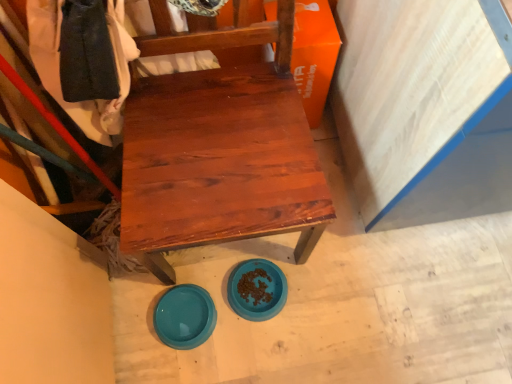
You are a GUI agent. You are given a task and a screenshot of the screen. Output one action in this format:
    pyautogui.click(x=<x>, y=<y>)
    Task: Click on the blue plastic bowl at lower center, marked as the 2th plate in a left-to-right arrangement
    Image resolution: width=512 pixels, height=384 pixels.
    Given the screenshot: What is the action you would take?
    pyautogui.click(x=257, y=289)

Consider the image. Measure the distance between matte wood chair at center and camera.

matte wood chair at center and camera are 33.08 inches apart.

At what (x,y) coordinates should I click in order to perform the action: click on blue plastic bowl at lower center, the 1th plate positioned from the right. Please return your answer as a coordinate pair (x, y). This screenshot has height=384, width=512. Looking at the image, I should click on (257, 289).

Is matte wood chair at center in front of or behind orange matte cardboard box at upper right in the image?

Clearly, matte wood chair at center is in front of orange matte cardboard box at upper right.

From a real-world perspective, between matte wood chair at center and orange matte cardboard box at upper right, who is vertically higher?

matte wood chair at center.

Could you tell me if matte wood chair at center is turned towards orange matte cardboard box at upper right?

No, matte wood chair at center does not turn towards orange matte cardboard box at upper right.

Can you tell me how much matte wood chair at center and orange matte cardboard box at upper right differ in facing direction?

The angular difference between matte wood chair at center and orange matte cardboard box at upper right is 1.07 degrees.

Is teal glossy plate at lower center, which is the second plate in right-to-left order, facing towards orange matte cardboard box at upper right?

No, teal glossy plate at lower center, which is the second plate in right-to-left order, is not turned towards orange matte cardboard box at upper right.

Who is bigger, teal glossy plate at lower center, which is the second plate in right-to-left order, or orange matte cardboard box at upper right?

orange matte cardboard box at upper right.

Which of these two, teal glossy plate at lower center, arranged as the 1th plate when viewed from the left, or orange matte cardboard box at upper right, stands shorter?

teal glossy plate at lower center, arranged as the 1th plate when viewed from the left, is shorter.

From the image's perspective, is teal glossy plate at lower center, which is the second plate in right-to-left order, positioned above or below orange matte cardboard box at upper right?

From the image's perspective, teal glossy plate at lower center, which is the second plate in right-to-left order, appears below orange matte cardboard box at upper right.

Which is in front, orange matte cardboard box at upper right or blue plastic bowl at lower center, marked as the 2th plate in a left-to-right arrangement?

orange matte cardboard box at upper right is in front.

Is orange matte cardboard box at upper right taller than blue plastic bowl at lower center, marked as the 2th plate in a left-to-right arrangement?

Yes.

Which object is positioned more to the left, orange matte cardboard box at upper right or blue plastic bowl at lower center, the 1th plate positioned from the right?

blue plastic bowl at lower center, the 1th plate positioned from the right, is more to the left.

Is orange matte cardboard box at upper right thinner than blue plastic bowl at lower center, the 1th plate positioned from the right?

Incorrect, the width of orange matte cardboard box at upper right is not less than that of blue plastic bowl at lower center, the 1th plate positioned from the right.

Who is more distant, blue plastic bowl at lower center, the 1th plate positioned from the right, or matte wood chair at center?

blue plastic bowl at lower center, the 1th plate positioned from the right, is further away from the camera.

Considering the points (269, 287) and (127, 173), which point is in front, point (269, 287) or point (127, 173)?

The point (127, 173) is closer to the camera.

Which is more to the left, blue plastic bowl at lower center, marked as the 2th plate in a left-to-right arrangement, or matte wood chair at center?

matte wood chair at center is more to the left.

Do you think blue plastic bowl at lower center, the 1th plate positioned from the right, is within matte wood chair at center, or outside of it?

blue plastic bowl at lower center, the 1th plate positioned from the right, is located inside matte wood chair at center.

Which object is positioned more to the right, blue plastic bowl at lower center, marked as the 2th plate in a left-to-right arrangement, or orange matte cardboard box at upper right?

orange matte cardboard box at upper right.

Considering the sizes of objects blue plastic bowl at lower center, marked as the 2th plate in a left-to-right arrangement, and orange matte cardboard box at upper right in the image provided, who is bigger, blue plastic bowl at lower center, marked as the 2th plate in a left-to-right arrangement, or orange matte cardboard box at upper right?

orange matte cardboard box at upper right is bigger.

Does point (240, 269) come behind point (321, 60)?

That is True.

Is teal glossy plate at lower center, which is the second plate in right-to-left order, positioned with its back to blue plastic bowl at lower center, the 1th plate positioned from the right?

teal glossy plate at lower center, which is the second plate in right-to-left order, does not have its back to blue plastic bowl at lower center, the 1th plate positioned from the right.

Considering the relative positions of teal glossy plate at lower center, arranged as the 1th plate when viewed from the left, and blue plastic bowl at lower center, the 1th plate positioned from the right, in the image provided, is teal glossy plate at lower center, arranged as the 1th plate when viewed from the left, to the left of blue plastic bowl at lower center, the 1th plate positioned from the right, from the viewer's perspective?

Yes, teal glossy plate at lower center, arranged as the 1th plate when viewed from the left, is to the left of blue plastic bowl at lower center, the 1th plate positioned from the right.

Is blue plastic bowl at lower center, the 1th plate positioned from the right, surrounded by teal glossy plate at lower center, arranged as the 1th plate when viewed from the left?

No, blue plastic bowl at lower center, the 1th plate positioned from the right, is not inside teal glossy plate at lower center, arranged as the 1th plate when viewed from the left.

Which point is more distant from viewer, (x=284, y=52) or (x=277, y=308)?

The point (x=277, y=308) is farther.

Consider the image. Which of these two, matte wood chair at center or blue plastic bowl at lower center, marked as the 2th plate in a left-to-right arrangement, stands taller?

matte wood chair at center.

Is matte wood chair at center wider than blue plastic bowl at lower center, the 1th plate positioned from the right?

Correct, the width of matte wood chair at center exceeds that of blue plastic bowl at lower center, the 1th plate positioned from the right.

At what (x,y) coordinates should I click in order to perform the action: click on chair lying on the left of orange matte cardboard box at upper right. Please return your answer as a coordinate pair (x, y). Looking at the image, I should click on (218, 147).

From the image's perspective, count 2nd plates downward from the orange matte cardboard box at upper right and point to it. Please provide its 2D coordinates.

[(185, 316)]

Estimate the real-world distances between objects in this image. Which object is closer to blue plastic bowl at lower center, marked as the 2th plate in a left-to-right arrangement, teal glossy plate at lower center, arranged as the 1th plate when viewed from the left, or matte wood chair at center?

Based on the image, teal glossy plate at lower center, arranged as the 1th plate when viewed from the left, appears to be nearer to blue plastic bowl at lower center, marked as the 2th plate in a left-to-right arrangement.

Estimate the real-world distances between objects in this image. Which object is closer to teal glossy plate at lower center, arranged as the 1th plate when viewed from the left, matte wood chair at center or orange matte cardboard box at upper right?

matte wood chair at center is closer to teal glossy plate at lower center, arranged as the 1th plate when viewed from the left.

From the image, which object appears to be nearer to matte wood chair at center, blue plastic bowl at lower center, marked as the 2th plate in a left-to-right arrangement, or orange matte cardboard box at upper right?

orange matte cardboard box at upper right lies closer to matte wood chair at center than the other object.

Based on their spatial positions, is teal glossy plate at lower center, arranged as the 1th plate when viewed from the left, or orange matte cardboard box at upper right further from blue plastic bowl at lower center, marked as the 2th plate in a left-to-right arrangement?

orange matte cardboard box at upper right is positioned further to the anchor blue plastic bowl at lower center, marked as the 2th plate in a left-to-right arrangement.

Based on their spatial positions, is blue plastic bowl at lower center, marked as the 2th plate in a left-to-right arrangement, or teal glossy plate at lower center, arranged as the 1th plate when viewed from the left, closer to orange matte cardboard box at upper right?

blue plastic bowl at lower center, marked as the 2th plate in a left-to-right arrangement, is closer to orange matte cardboard box at upper right.

Based on their spatial positions, is orange matte cardboard box at upper right or blue plastic bowl at lower center, the 1th plate positioned from the right, closer to matte wood chair at center?

Based on the image, orange matte cardboard box at upper right appears to be nearer to matte wood chair at center.

Which object lies nearer to the anchor point orange matte cardboard box at upper right, teal glossy plate at lower center, arranged as the 1th plate when viewed from the left, or blue plastic bowl at lower center, marked as the 2th plate in a left-to-right arrangement?

blue plastic bowl at lower center, marked as the 2th plate in a left-to-right arrangement, is positioned closer to the anchor orange matte cardboard box at upper right.

Estimate the real-world distances between objects in this image. Which object is closer to blue plastic bowl at lower center, marked as the 2th plate in a left-to-right arrangement, orange matte cardboard box at upper right or matte wood chair at center?

The object closer to blue plastic bowl at lower center, marked as the 2th plate in a left-to-right arrangement, is matte wood chair at center.

Locate an element on the screen. The image size is (512, 384). cardboard box between matte wood chair at center and blue plastic bowl at lower center, marked as the 2th plate in a left-to-right arrangement, in the front-back direction is located at coordinates (314, 55).

Locate an element on the screen. The width and height of the screenshot is (512, 384). plate positioned between matte wood chair at center and blue plastic bowl at lower center, the 1th plate positioned from the right, from near to far is located at coordinates (185, 316).

Identify the location of cardboard box between matte wood chair at center and teal glossy plate at lower center, arranged as the 1th plate when viewed from the left, in the front-back direction. The height and width of the screenshot is (384, 512). tap(314, 55).

Find the location of a particular element. The height and width of the screenshot is (384, 512). plate between orange matte cardboard box at upper right and teal glossy plate at lower center, which is the second plate in right-to-left order, in the up-down direction is located at coordinates (257, 289).